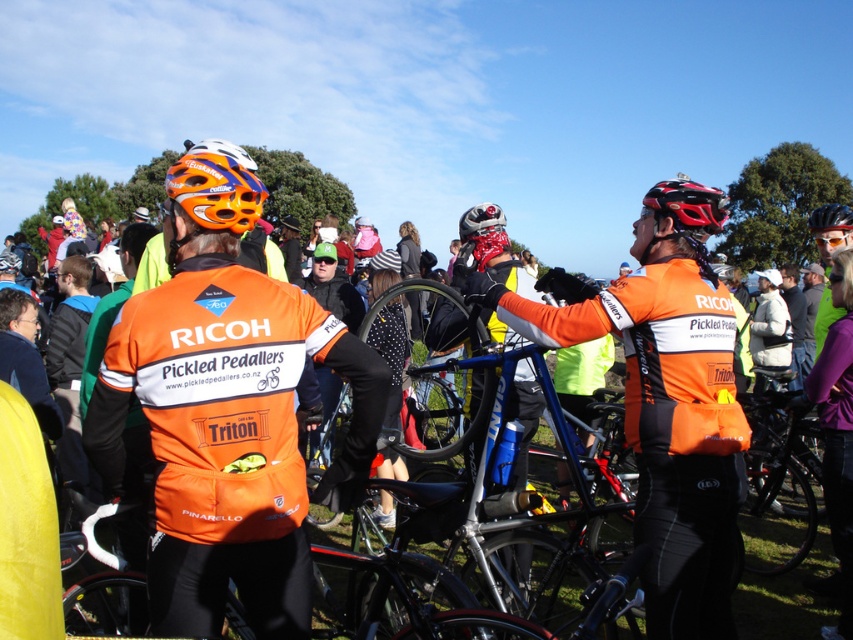
You are a photographer at the event and need to position a camera to capture the orange matte bicycle helmet at upper left. The camera is set up at the origin point. What are the coordinates of the helmet relative to the camera?

The orange matte bicycle helmet at upper left is located at point coordinates of (215, 189).

You are standing at the event and want to take a photo of the shiny black helmet at center. If your camera has a maximum focus range of 15 feet, will you need to move closer to capture it clearly?

The shiny black helmet at center is 15.77 feet away from you. Since your camera can only focus up to 15 feet, you need to move closer to ensure it is in focus.